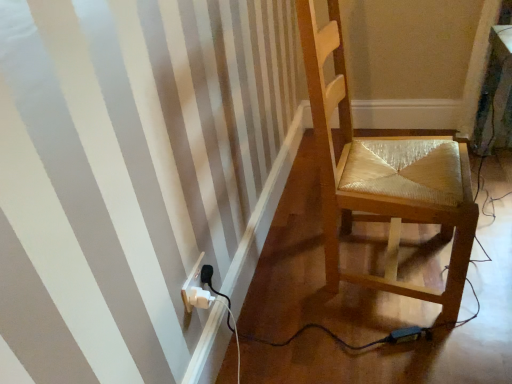
Locate an element on the screen. vacant space in wooden chair at right (from a real-world perspective) is located at coordinates (388, 263).